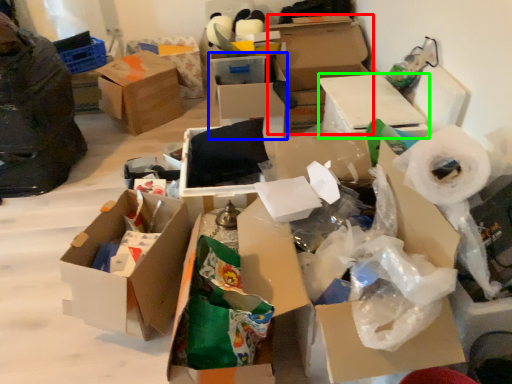
Question: Estimate the real-world distances between objects in this image. Which object is closer to box (highlighted by a red box), box (highlighted by a blue box) or box (highlighted by a green box)?

Choices:
 (A) box
 (B) box

Answer: (A)